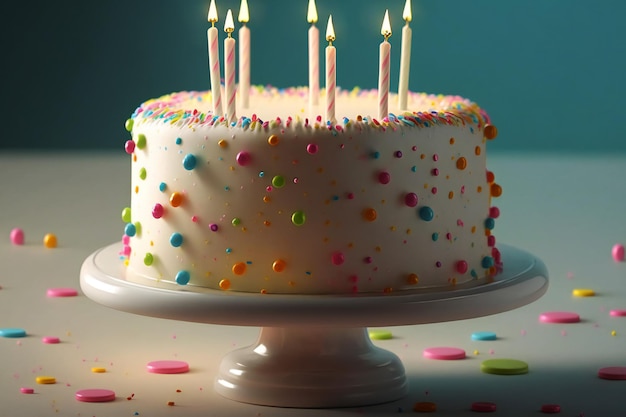
Where is `flames on candles`? This screenshot has height=417, width=626. flames on candles is located at coordinates (212, 9), (223, 22), (240, 10), (310, 13), (334, 33), (384, 25), (404, 13).